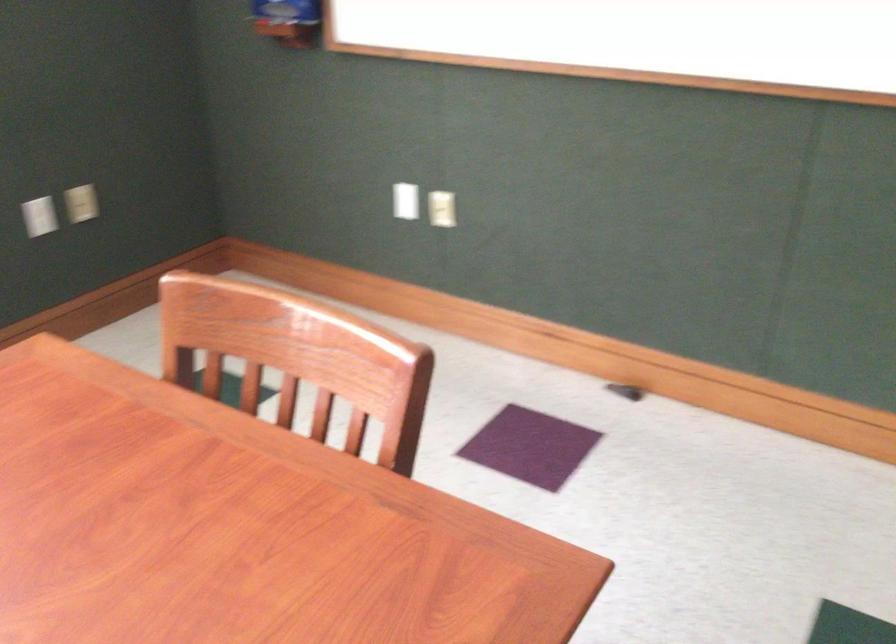
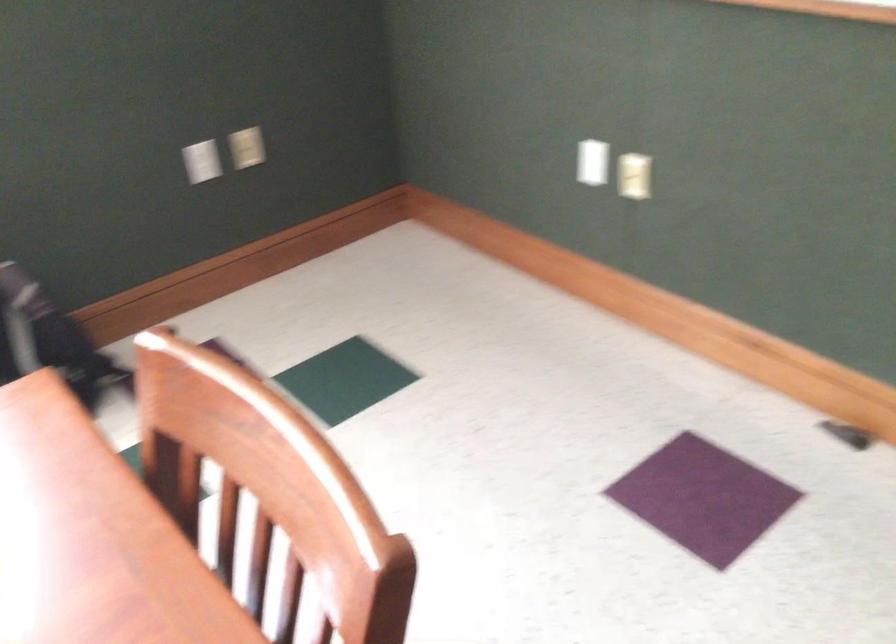
What movement of the cameraman would produce the second image?

The cameraman walked toward right, forward.